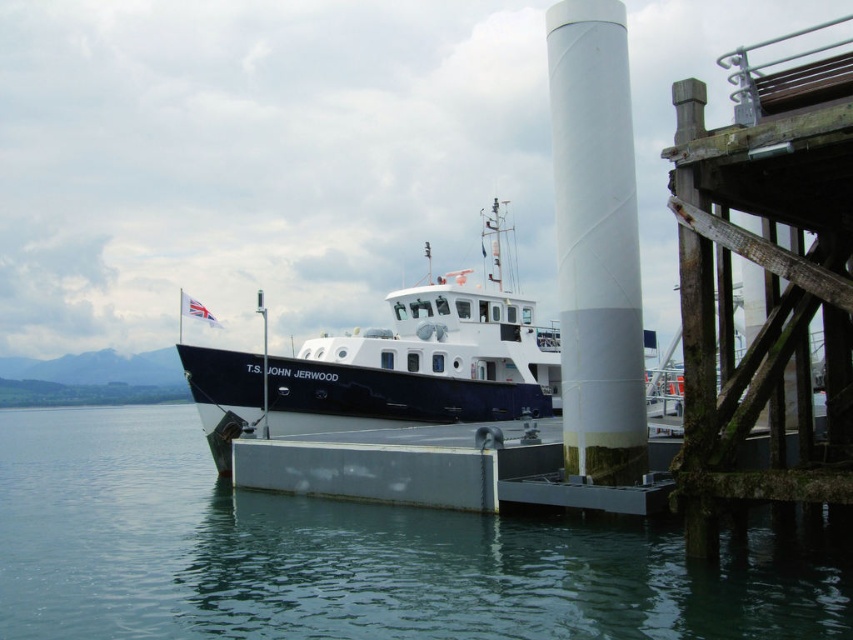
Is clear water at lower center further to the viewer compared to white textured pipe at center?

No, clear water at lower center is closer to the viewer.

Is point (521, 614) less distant than point (608, 428)?

Yes.

Is point (119, 525) farther from viewer compared to point (589, 380)?

That is True.

Locate an element on the screen. clear water at lower center is located at coordinates (349, 556).

Is white glossy boat at center closer to camera compared to white textured pipe at center?

That is False.

Is white glossy boat at center further to camera compared to white textured pipe at center?

Yes, it is.

Is point (247, 356) closer to viewer compared to point (579, 214)?

That is False.

Locate an element on the screen. The height and width of the screenshot is (640, 853). white glossy boat at center is located at coordinates (386, 372).

Is clear water at lower center above white glossy boat at center?

Actually, clear water at lower center is below white glossy boat at center.

Is clear water at lower center wider than white glossy boat at center?

Indeed, clear water at lower center has a greater width compared to white glossy boat at center.

Image resolution: width=853 pixels, height=640 pixels. I want to click on clear water at lower center, so click(x=349, y=556).